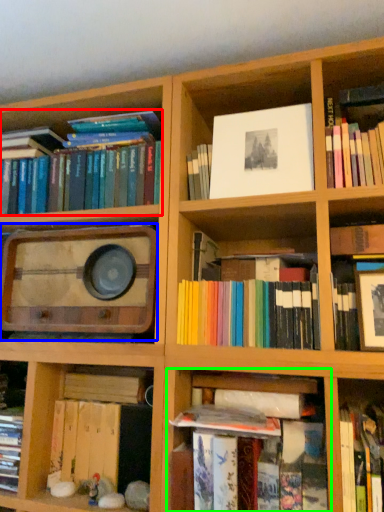
Question: Which object is the closest to the book (highlighted by a red box)? Choose among these: stereo (highlighted by a blue box) or shelf (highlighted by a green box).

Choices:
 (A) stereo
 (B) shelf

Answer: (A)